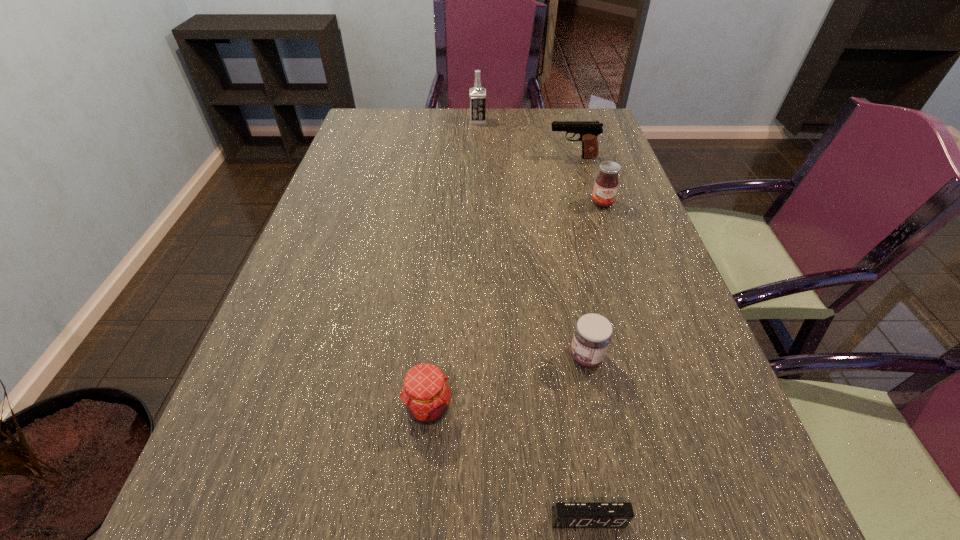
Identify the location of free area in between the tallest jam and the leftmost object. (516, 306).

Identify the location of free spot between the leftmost jam and the fourth farthest object. (507, 383).

The width and height of the screenshot is (960, 540). In order to click on unoccupied area between the tallest jam and the second nearest object in this screenshot , I will do `click(516, 306)`.

Find the location of a particular element. free space between the pistol and the leftmost jam is located at coordinates (500, 283).

Identify the location of object identified as the second closest to the vodka. This screenshot has width=960, height=540. (606, 184).

Where is `object that is the second closest to the alarm clock`? The height and width of the screenshot is (540, 960). object that is the second closest to the alarm clock is located at coordinates (592, 335).

Point out which jam is positioned as the third nearest to the nearest object. Please provide its 2D coordinates. Your answer should be formatted as a tuple, i.e. [(x, y)], where the tuple contains the x and y coordinates of a point satisfying the conditions above.

[(606, 184)]

Image resolution: width=960 pixels, height=540 pixels. What are the coordinates of `jam that is the second closest to the rightmost jam` in the screenshot? It's located at (426, 394).

Locate an element on the screen. Image resolution: width=960 pixels, height=540 pixels. free location that satisfies the following two spatial constraints: 1. on the label side of the rightmost jam; 2. on the front label of the second farthest jam is located at coordinates (654, 357).

Locate an element on the screen. This screenshot has width=960, height=540. vacant space that satisfies the following two spatial constraints: 1. at the barrel of the pistol; 2. on the front side of the second nearest object is located at coordinates (645, 408).